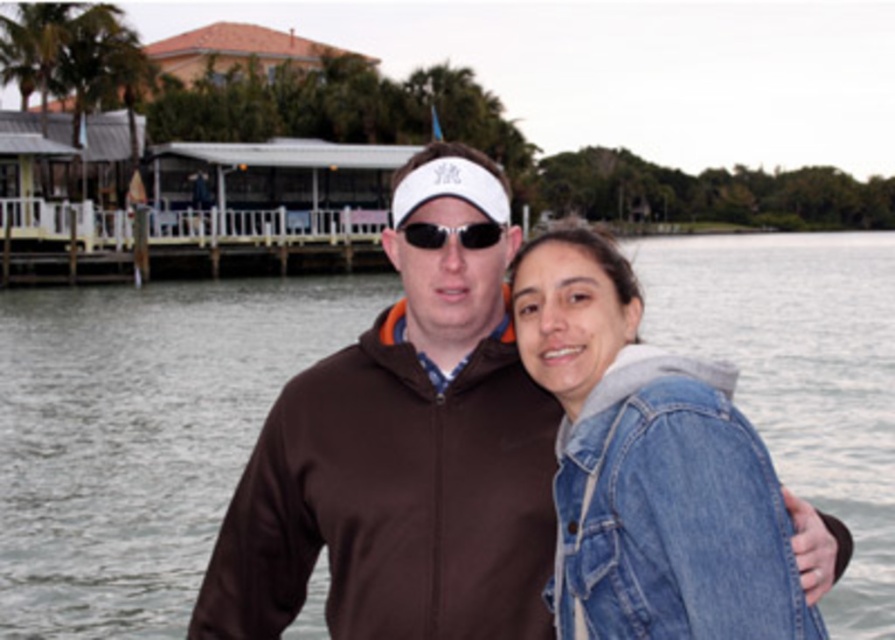
Can you confirm if denim jacket at lower right is wider than black plastic sunglasses at center?

Indeed, denim jacket at lower right has a greater width compared to black plastic sunglasses at center.

Measure the distance between denim jacket at lower right and camera.

The distance of denim jacket at lower right from camera is 5.60 meters.

Does point (581, 289) come closer to viewer compared to point (437, 232)?

Yes, point (581, 289) is in front of point (437, 232).

I want to click on denim jacket at lower right, so click(x=648, y=467).

Is point (548, 628) farther from camera compared to point (465, 224)?

That is False.

Is brown softshell jacket at center smaller than black plastic sunglasses at center?

Incorrect, brown softshell jacket at center is not smaller in size than black plastic sunglasses at center.

Find the location of a particular element. The width and height of the screenshot is (895, 640). brown softshell jacket at center is located at coordinates tap(403, 456).

The height and width of the screenshot is (640, 895). Find the location of `brown softshell jacket at center`. brown softshell jacket at center is located at coordinates (403, 456).

From the picture: Who is more forward, (433, 618) or (732, 627)?

Point (732, 627) is in front.

Measure the distance between point (507, 512) and camera.

Point (507, 512) and camera are 24.57 feet apart.

This screenshot has width=895, height=640. What do you see at coordinates (403, 456) in the screenshot?
I see `brown softshell jacket at center` at bounding box center [403, 456].

This screenshot has width=895, height=640. In order to click on brown softshell jacket at center in this screenshot , I will do `click(403, 456)`.